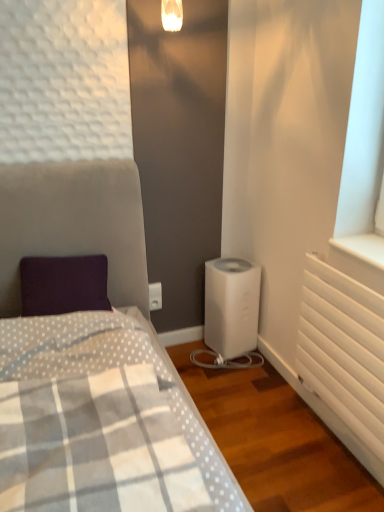
Question: Is white plastic water heater at lower center at the back of white matte radiator at right?

Choices:
 (A) yes
 (B) no

Answer: (B)

Question: Does white matte radiator at right have a lesser height compared to white plastic water heater at lower center?

Choices:
 (A) yes
 (B) no

Answer: (B)

Question: Does white matte radiator at right come behind white plastic water heater at lower center?

Choices:
 (A) yes
 (B) no

Answer: (B)

Question: Is white matte radiator at right oriented towards white plastic water heater at lower center?

Choices:
 (A) no
 (B) yes

Answer: (A)

Question: Is white plastic water heater at lower center completely or partially inside white matte radiator at right?

Choices:
 (A) no
 (B) yes

Answer: (A)

Question: Is white matte radiator at right to the left or to the right of white plastic electric outlet at center in the image?

Choices:
 (A) left
 (B) right

Answer: (B)

Question: From a real-world perspective, is white matte radiator at right above or below white plastic electric outlet at center?

Choices:
 (A) below
 (B) above

Answer: (B)

Question: From their relative heights in the image, would you say white matte radiator at right is taller or shorter than white plastic electric outlet at center?

Choices:
 (A) short
 (B) tall

Answer: (B)

Question: Is white matte radiator at right inside or outside of white plastic electric outlet at center?

Choices:
 (A) outside
 (B) inside

Answer: (A)

Question: Looking at the image, does white plastic electric outlet at center seem bigger or smaller compared to white plastic water heater at lower center?

Choices:
 (A) big
 (B) small

Answer: (B)

Question: Is white plastic electric outlet at center taller or shorter than white plastic water heater at lower center?

Choices:
 (A) short
 (B) tall

Answer: (A)

Question: Is white plastic electric outlet at center wider or thinner than white plastic water heater at lower center?

Choices:
 (A) wide
 (B) thin

Answer: (B)

Question: In the image, is white plastic electric outlet at center on the left side or the right side of white plastic water heater at lower center?

Choices:
 (A) right
 (B) left

Answer: (B)

Question: In terms of width, does white matte radiator at right look wider or thinner when compared to white plastic water heater at lower center?

Choices:
 (A) wide
 (B) thin

Answer: (B)

Question: From a real-world perspective, is white matte radiator at right positioned above or below white plastic water heater at lower center?

Choices:
 (A) above
 (B) below

Answer: (A)